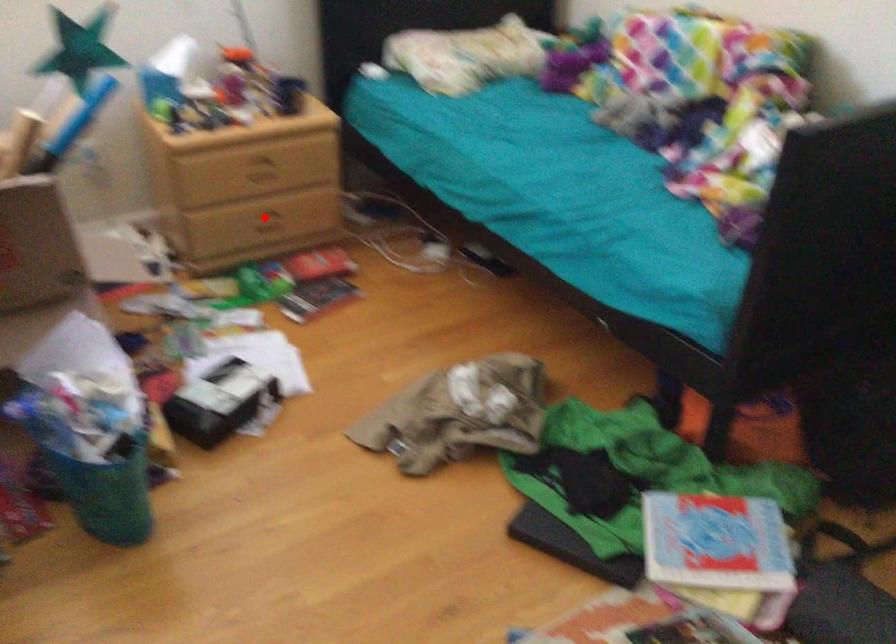
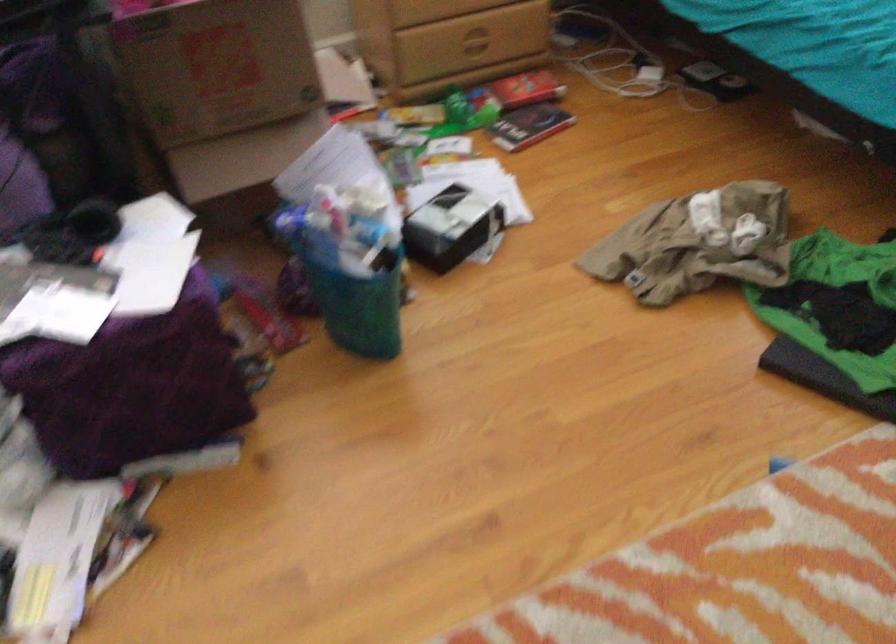
The point at the highlighted location is marked in the first image. Where is the corresponding point in the second image?

(472, 40)